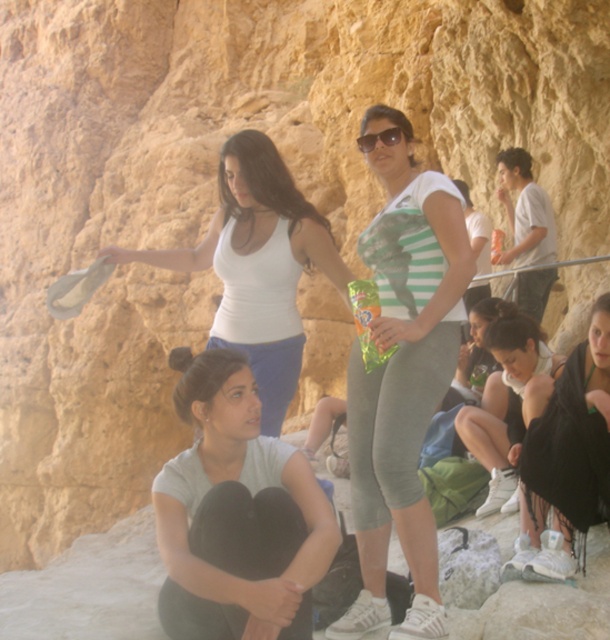
Question: Among these objects, which one is farthest from the camera?

Choices:
 (A) green striped tank top at center
 (B) black fabric dress at lower right

Answer: (B)

Question: Which point is closer to the camera?

Choices:
 (A) green striped tank top at center
 (B) matte black sunglasses at center
 (C) black fabric dress at lower right
 (D) gray matte shirt at lower center

Answer: (D)

Question: Can you confirm if green striped tank top at center is positioned to the right of matte black sunglasses at center?

Choices:
 (A) no
 (B) yes

Answer: (B)

Question: Does gray matte shirt at lower center appear over white matte tank top at upper center?

Choices:
 (A) yes
 (B) no

Answer: (B)

Question: Is green striped tank top at center to the left of black fabric dress at lower right from the viewer's perspective?

Choices:
 (A) yes
 (B) no

Answer: (A)

Question: Estimate the real-world distances between objects in this image. Which object is farther from the green striped tank top at center?

Choices:
 (A) gray matte shirt at lower center
 (B) matte black sunglasses at center
 (C) white matte tank top at upper center
 (D) black fabric dress at lower right

Answer: (D)